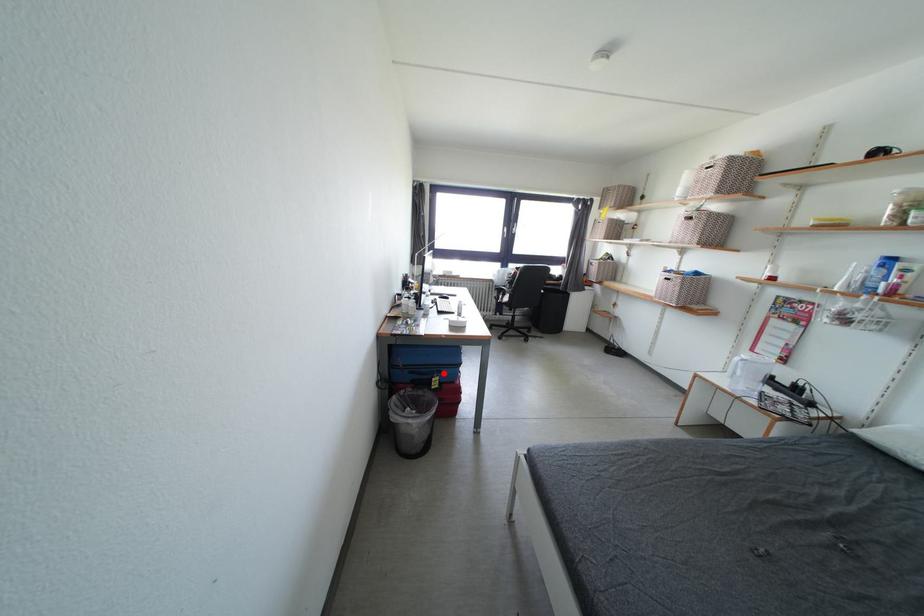
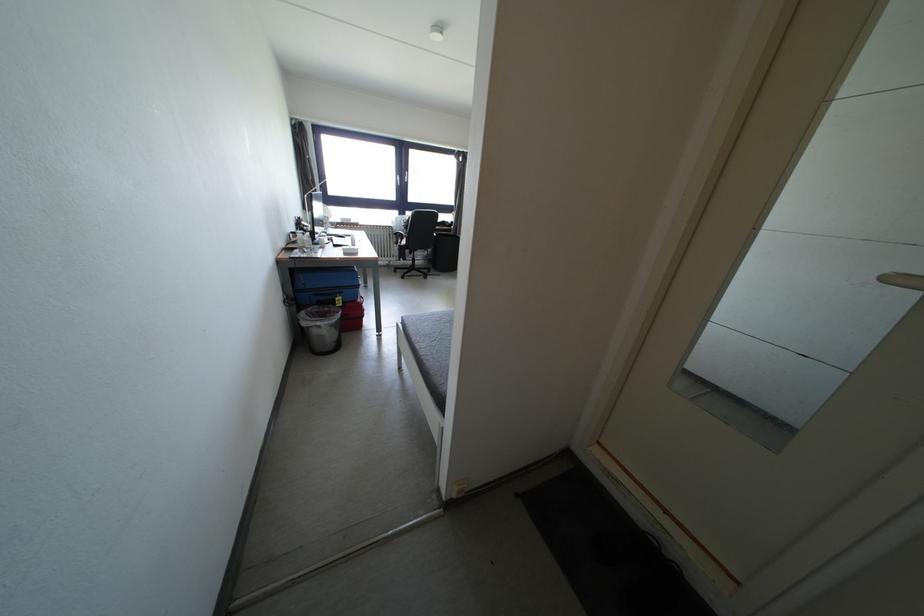
Where in the second image is the point corresponding to the highlighted location from the first image?

(345, 294)